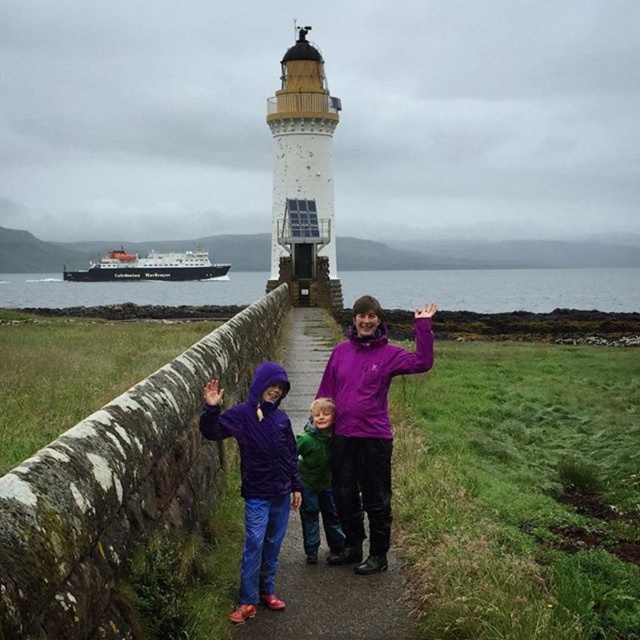
Does clear water at center have a greater width compared to green matte jacket at center?

Yes, clear water at center is wider than green matte jacket at center.

Is clear water at center positioned behind green matte jacket at center?

Yes, it is.

Which is in front, point (564, 307) or point (317, 516)?

Point (317, 516) is more forward.

Where is `clear water at center`? clear water at center is located at coordinates (499, 289).

Is point (486, 269) in front of point (380, 323)?

No, it is not.

Which is more to the right, clear water at center or purple fleece jacket at center?

purple fleece jacket at center is more to the right.

Identify the location of clear water at center. (499, 289).

At what (x,y) coordinates should I click in order to perform the action: click on clear water at center. Please return your answer as a coordinate pair (x, y). The image size is (640, 640). Looking at the image, I should click on (499, 289).

Find the location of a particular element. clear water at center is located at coordinates (499, 289).

Is point (621, 310) less distant than point (348, 573)?

No, it is behind (348, 573).

Between point (572, 307) and point (307, 392), which one is positioned in front?

Point (307, 392) is in front.

The width and height of the screenshot is (640, 640). What are the coordinates of `clear water at center` in the screenshot? It's located at (499, 289).